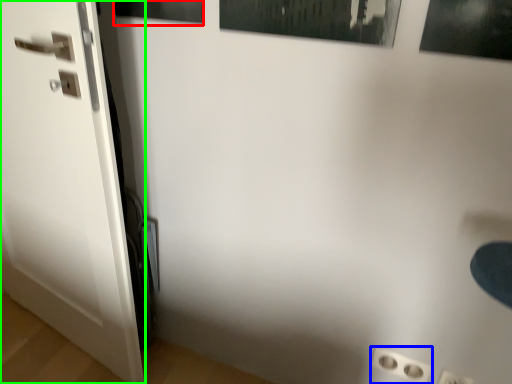
Question: Which object is the closest to the picture frame (highlighted by a red box)? Choose among these: electric outlet (highlighted by a blue box) or door (highlighted by a green box).

Choices:
 (A) electric outlet
 (B) door

Answer: (B)